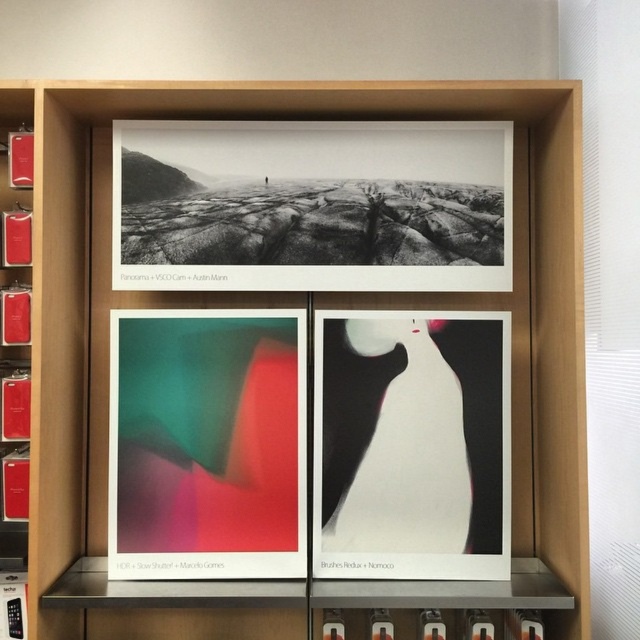
Question: Which of these objects is positioned farthest from the black matte print at upper center?

Choices:
 (A) matte plastic poster at center
 (B) white glossy vase at center

Answer: (B)

Question: Is black matte print at upper center to the right of matte plastic poster at center from the viewer's perspective?

Choices:
 (A) no
 (B) yes

Answer: (B)

Question: Based on their relative distances, which object is farther from the white glossy vase at center?

Choices:
 (A) matte plastic poster at center
 (B) black matte print at upper center

Answer: (B)

Question: Does matte plastic poster at center appear over white glossy vase at center?

Choices:
 (A) yes
 (B) no

Answer: (B)

Question: Is matte plastic poster at center smaller than white glossy vase at center?

Choices:
 (A) yes
 (B) no

Answer: (B)

Question: Estimate the real-world distances between objects in this image. Which object is farther from the black matte print at upper center?

Choices:
 (A) matte plastic poster at center
 (B) white glossy vase at center

Answer: (B)